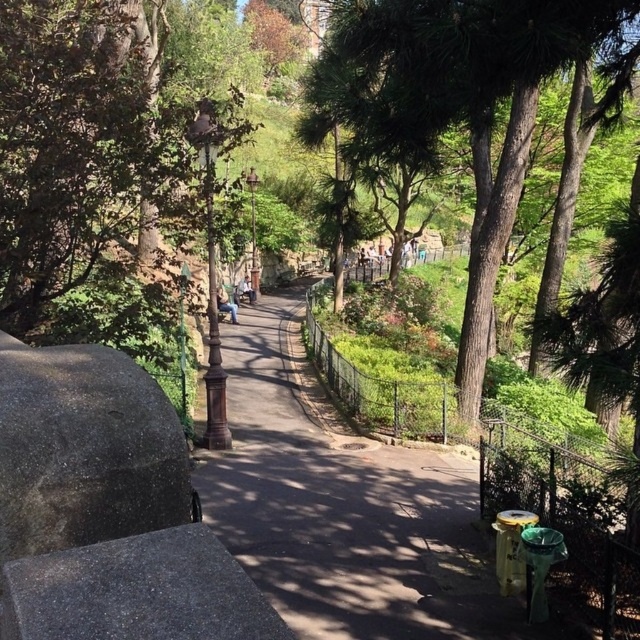
Which is more to the left, denim jacket at center or light blue jeans at center?

From the viewer's perspective, denim jacket at center appears more on the left side.

Who is lower down, denim jacket at center or light blue jeans at center?

denim jacket at center

What do you see at coordinates (225, 304) in the screenshot?
I see `denim jacket at center` at bounding box center [225, 304].

What are the coordinates of `denim jacket at center` in the screenshot? It's located at (225, 304).

Who is higher up, green textured tree at center or light blue jeans at center?

green textured tree at center

In the scene shown: Does green textured tree at center have a greater width compared to light blue jeans at center?

Correct, the width of green textured tree at center exceeds that of light blue jeans at center.

Find the location of `green textured tree at center`. green textured tree at center is located at coordinates (461, 100).

This screenshot has height=640, width=640. Identify the location of green textured tree at center. (461, 100).

Does green textured tree at center have a greater width compared to denim jacket at center?

Indeed, green textured tree at center has a greater width compared to denim jacket at center.

Who is lower down, green textured tree at center or denim jacket at center?

denim jacket at center

The width and height of the screenshot is (640, 640). What are the coordinates of `green textured tree at center` in the screenshot? It's located at (461, 100).